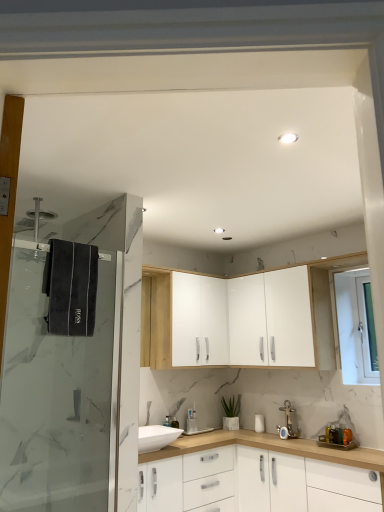
Question: Is gold metallic faucet at lower right bigger than white matte cabinet at center, which is counted as the first cabinetry, starting from the bottom?

Choices:
 (A) no
 (B) yes

Answer: (A)

Question: From a real-world perspective, is gold metallic faucet at lower right beneath white matte cabinet at center, which is counted as the first cabinetry, starting from the bottom?

Choices:
 (A) no
 (B) yes

Answer: (A)

Question: From the image's perspective, is gold metallic faucet at lower right on white matte cabinet at center, acting as the 3th cabinetry starting from the top?

Choices:
 (A) no
 (B) yes

Answer: (B)

Question: Does gold metallic faucet at lower right appear on the left side of white matte cabinet at center, acting as the 3th cabinetry starting from the top?

Choices:
 (A) no
 (B) yes

Answer: (B)

Question: Is gold metallic faucet at lower right far from white matte cabinet at center, which is counted as the first cabinetry, starting from the bottom?

Choices:
 (A) yes
 (B) no

Answer: (B)

Question: Is white glossy cabinet at upper center, positioned as the 2th cabinetry in top-to-bottom order, inside the boundaries of gold metallic faucet at lower right, or outside?

Choices:
 (A) inside
 (B) outside

Answer: (B)

Question: Relative to gold metallic faucet at lower right, is white glossy cabinet at upper center, placed as the second cabinetry when sorted from bottom to top, in front or behind?

Choices:
 (A) behind
 (B) front

Answer: (B)

Question: From a real-world perspective, relative to gold metallic faucet at lower right, is white glossy cabinet at upper center, placed as the second cabinetry when sorted from bottom to top, vertically above or below?

Choices:
 (A) above
 (B) below

Answer: (A)

Question: From the image's perspective, relative to gold metallic faucet at lower right, is white glossy cabinet at upper center, positioned as the 2th cabinetry in top-to-bottom order, above or below?

Choices:
 (A) above
 (B) below

Answer: (A)

Question: Looking at their shapes, would you say gold metallic faucet at lower right is wider or thinner than white glossy light fixture at upper center?

Choices:
 (A) wide
 (B) thin

Answer: (A)

Question: Considering the positions of gold metallic faucet at lower right and white glossy light fixture at upper center in the image, is gold metallic faucet at lower right taller or shorter than white glossy light fixture at upper center?

Choices:
 (A) tall
 (B) short

Answer: (A)

Question: From a real-world perspective, is gold metallic faucet at lower right positioned above or below white glossy light fixture at upper center?

Choices:
 (A) above
 (B) below

Answer: (B)

Question: Is point (x=292, y=409) positioned closer to the camera than point (x=284, y=139)?

Choices:
 (A) closer
 (B) farther

Answer: (B)

Question: Relative to white glossy light fixture at upper center, is white matte cabinet at center, acting as the 3th cabinetry starting from the top, in front or behind?

Choices:
 (A) front
 (B) behind

Answer: (B)

Question: Would you say white matte cabinet at center, acting as the 3th cabinetry starting from the top, is inside or outside white glossy light fixture at upper center?

Choices:
 (A) outside
 (B) inside

Answer: (A)